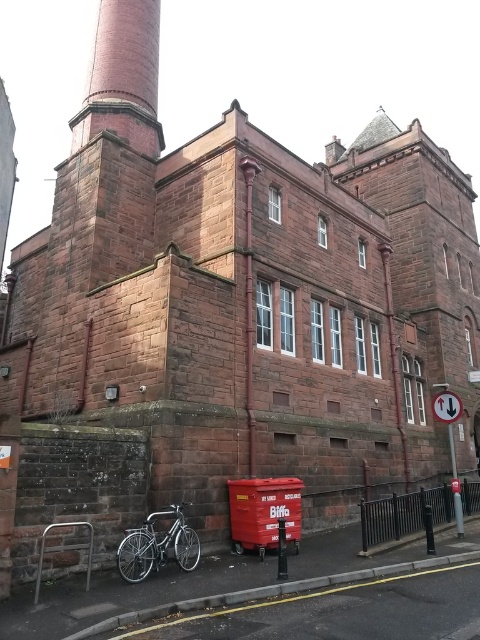
Question: Among these objects, which one is nearest to the camera?

Choices:
 (A) silver metallic bicycle at lower left
 (B) red brick chimney at upper left

Answer: (A)

Question: Can you confirm if red brick chimney at upper left is thinner than silver metallic bicycle at lower left?

Choices:
 (A) no
 (B) yes

Answer: (A)

Question: Among these points, which one is nearest to the camera?

Choices:
 (A) (124, 547)
 (B) (152, 129)

Answer: (A)

Question: Where is red brick chimney at upper left located in relation to silver metallic bicycle at lower left in the image?

Choices:
 (A) right
 (B) left

Answer: (B)

Question: Is red brick chimney at upper left further to camera compared to silver metallic bicycle at lower left?

Choices:
 (A) no
 (B) yes

Answer: (B)